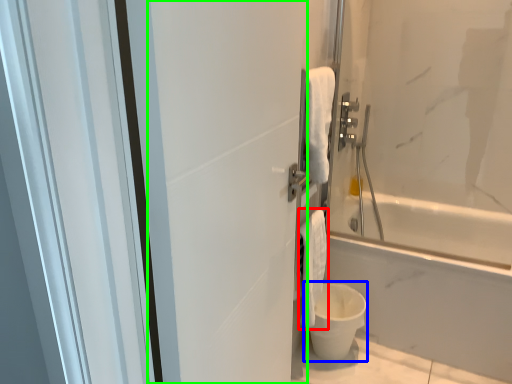
Question: Which object is the farthest from bath towel (highlighted by a red box)? Choose among these: toilet bowl (highlighted by a blue box) or screen door (highlighted by a green box).

Choices:
 (A) toilet bowl
 (B) screen door

Answer: (B)